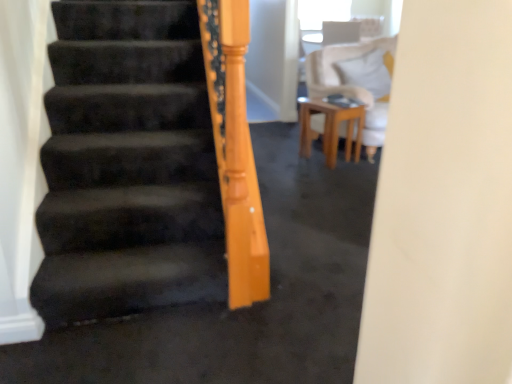
The width and height of the screenshot is (512, 384). What are the coordinates of `white soft pillow at upper right` in the screenshot? It's located at [368, 72].

Identify the location of wooden table at center. This screenshot has height=384, width=512. (330, 128).

Measure the distance from wooden table at center to white soft pillow at upper right.

A distance of 21.34 inches exists between wooden table at center and white soft pillow at upper right.

From a real-world perspective, between wooden table at center and white soft pillow at upper right, who is vertically lower?

wooden table at center is physically lower.

Is wooden table at center looking in the opposite direction of white soft pillow at upper right?

No, wooden table at center is not facing the opposite direction of white soft pillow at upper right.

From the image's perspective, is wooden table at center located above or below white soft pillow at upper right?

Clearly, from the image's perspective, wooden table at center is below white soft pillow at upper right.

From a real-world perspective, which is physically below, transparent plastic window screen at upper center or white soft pillow at upper right?

white soft pillow at upper right, from a real-world perspective.

Which is farther, [314,22] or [382,78]?

The point [314,22] is farther.

Considering the relative sizes of transparent plastic window screen at upper center and white soft pillow at upper right in the image provided, is transparent plastic window screen at upper center bigger than white soft pillow at upper right?

Actually, transparent plastic window screen at upper center might be smaller than white soft pillow at upper right.

Find the location of a particular element. This screenshot has width=512, height=384. window screen behind the white soft pillow at upper right is located at coordinates (322, 12).

Based on the photo, from a real-world perspective, which is physically below, transparent plastic window screen at upper center or wooden table at center?

From a 3D spatial view, wooden table at center is below.

Between transparent plastic window screen at upper center and wooden table at center, which one has more height?

wooden table at center is taller.

Consider the image. Is transparent plastic window screen at upper center bigger than wooden table at center?

Correct, transparent plastic window screen at upper center is larger in size than wooden table at center.

Can you tell me how much transparent plastic window screen at upper center and wooden table at center differ in facing direction?

There is a 22.4-degree angle between the facing directions of transparent plastic window screen at upper center and wooden table at center.

Between white soft pillow at upper right and transparent plastic window screen at upper center, which one has more height?

white soft pillow at upper right.

Considering the sizes of white soft pillow at upper right and transparent plastic window screen at upper center in the image, is white soft pillow at upper right wider or thinner than transparent plastic window screen at upper center?

Considering their sizes, white soft pillow at upper right looks slimmer than transparent plastic window screen at upper center.

Considering the points (388, 80) and (313, 3), which point is behind, point (388, 80) or point (313, 3)?

Point (313, 3)

Which is more to the left, white soft pillow at upper right or transparent plastic window screen at upper center?

Positioned to the left is white soft pillow at upper right.

Which object is positioned more to the right, wooden table at center or transparent plastic window screen at upper center?

transparent plastic window screen at upper center.

Can transparent plastic window screen at upper center be found inside wooden table at center?

No, transparent plastic window screen at upper center is not inside wooden table at center.

From the image's perspective, which is above, wooden table at center or transparent plastic window screen at upper center?

transparent plastic window screen at upper center is shown above in the image.

Which object is wider, wooden table at center or transparent plastic window screen at upper center?

wooden table at center.

Who is bigger, white soft pillow at upper right or wooden table at center?

With larger size is white soft pillow at upper right.

From the image's perspective, is white soft pillow at upper right positioned above or below wooden table at center?

Clearly, from the image's perspective, white soft pillow at upper right is above wooden table at center.

Is white soft pillow at upper right spatially inside wooden table at center, or outside of it?

white soft pillow at upper right exists outside the volume of wooden table at center.

From a real-world perspective, is white soft pillow at upper right positioned over wooden table at center based on gravity?

Yes.

Identify the location of pillow that appears on the right of wooden table at center. (368, 72).

Find the location of a particular element. This screenshot has height=384, width=512. pillow beneath the transparent plastic window screen at upper center (from a real-world perspective) is located at coordinates (368, 72).

Estimate the real-world distances between objects in this image. Which object is closer to white soft pillow at upper right, transparent plastic window screen at upper center or wooden table at center?

wooden table at center is closer to white soft pillow at upper right.

Based on their spatial positions, is white soft pillow at upper right or wooden table at center further from transparent plastic window screen at upper center?

wooden table at center is positioned further to the anchor transparent plastic window screen at upper center.

Based on their spatial positions, is wooden table at center or white soft pillow at upper right further from transparent plastic window screen at upper center?

Among the two, wooden table at center is located further to transparent plastic window screen at upper center.

From the image, which object appears to be farther from wooden table at center, white soft pillow at upper right or transparent plastic window screen at upper center?

transparent plastic window screen at upper center is positioned further to the anchor wooden table at center.

Consider the image. Considering their positions, is transparent plastic window screen at upper center positioned closer to wooden table at center than white soft pillow at upper right?

white soft pillow at upper right lies closer to wooden table at center than the other object.

From the image, which object appears to be farther from white soft pillow at upper right, wooden table at center or transparent plastic window screen at upper center?

The object further to white soft pillow at upper right is transparent plastic window screen at upper center.

I want to click on pillow positioned between wooden table at center and transparent plastic window screen at upper center from near to far, so click(x=368, y=72).